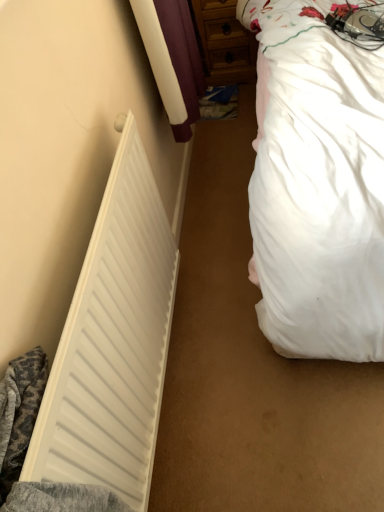
Question: Is white matte radiator at left at the back of white soft bed at right?

Choices:
 (A) no
 (B) yes

Answer: (A)

Question: From the image's perspective, does white soft bed at right appear lower than white matte radiator at left?

Choices:
 (A) yes
 (B) no

Answer: (B)

Question: Is white soft bed at right thinner than white matte radiator at left?

Choices:
 (A) yes
 (B) no

Answer: (B)

Question: Is white soft bed at right located outside white matte radiator at left?

Choices:
 (A) yes
 (B) no

Answer: (A)

Question: Is white soft bed at right aimed at white matte radiator at left?

Choices:
 (A) yes
 (B) no

Answer: (B)

Question: From a real-world perspective, is white soft bed at right under white matte radiator at left?

Choices:
 (A) no
 (B) yes

Answer: (A)

Question: From the image's perspective, is wooden dresser at upper center under white matte radiator at left?

Choices:
 (A) no
 (B) yes

Answer: (A)

Question: Are wooden dresser at upper center and white matte radiator at left far apart?

Choices:
 (A) yes
 (B) no

Answer: (A)

Question: From a real-world perspective, does wooden dresser at upper center stand above white matte radiator at left?

Choices:
 (A) no
 (B) yes

Answer: (A)

Question: Is wooden dresser at upper center not inside white matte radiator at left?

Choices:
 (A) no
 (B) yes

Answer: (B)

Question: Is wooden dresser at upper center in front of white matte radiator at left?

Choices:
 (A) no
 (B) yes

Answer: (A)

Question: Is wooden dresser at upper center smaller than white matte radiator at left?

Choices:
 (A) no
 (B) yes

Answer: (A)

Question: Considering the relative sizes of white soft bed at right and wooden dresser at upper center in the image provided, is white soft bed at right bigger than wooden dresser at upper center?

Choices:
 (A) yes
 (B) no

Answer: (A)